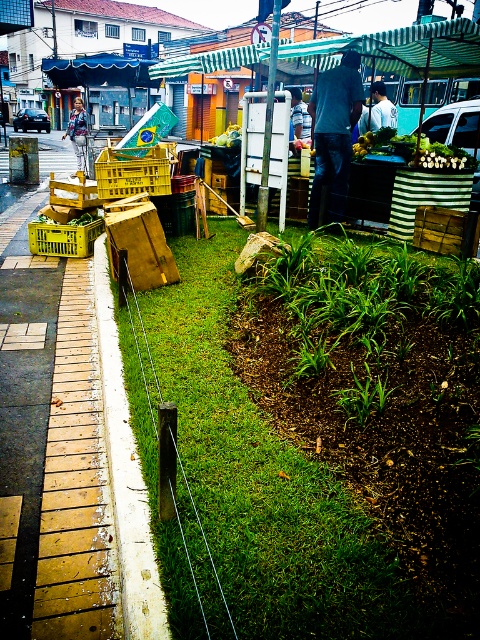
Measure the distance between dark blue shirt at center and camera.

dark blue shirt at center is 6.78 meters from camera.

Does point (310, 220) come farther from viewer compared to point (73, 108)?

No, it is in front of (73, 108).

You are a GUI agent. You are given a task and a screenshot of the screen. Output one action in this format:
    pyautogui.click(x=<x>, y=<y>)
    Task: Click on the dark blue shirt at center
    The width and height of the screenshot is (480, 640).
    Given the screenshot: What is the action you would take?
    pyautogui.click(x=334, y=132)

Find the location of `yellow painted concrete pavement at left`. yellow painted concrete pavement at left is located at coordinates (52, 448).

Who is shorter, yellow painted concrete pavement at left or white concrete curb at lower left?

white concrete curb at lower left

At what (x,y) coordinates should I click in order to perform the action: click on yellow painted concrete pavement at left. Please return your answer as a coordinate pair (x, y). Looking at the image, I should click on (52, 448).

Can you confirm if yellow plastic crate at center is bigger than green leafy produce at center?

No, yellow plastic crate at center is not bigger than green leafy produce at center.

Can you confirm if yellow plastic crate at center is smaller than green leafy produce at center?

Correct, yellow plastic crate at center occupies less space than green leafy produce at center.

The width and height of the screenshot is (480, 640). What do you see at coordinates (73, 193) in the screenshot?
I see `yellow plastic crate at center` at bounding box center [73, 193].

Locate an element on the screen. This screenshot has width=480, height=640. yellow plastic crate at center is located at coordinates (73, 193).